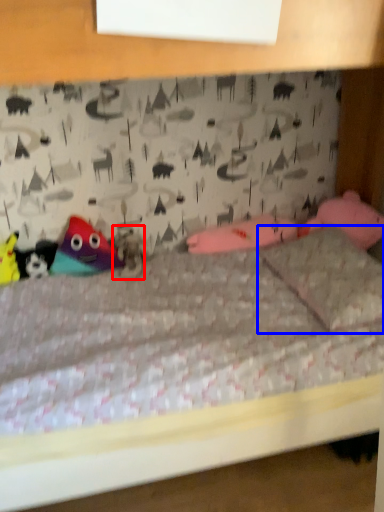
Question: Among these objects, which one is farthest to the camera, animal (highlighted by a red box) or pillow (highlighted by a blue box)?

Choices:
 (A) animal
 (B) pillow

Answer: (A)